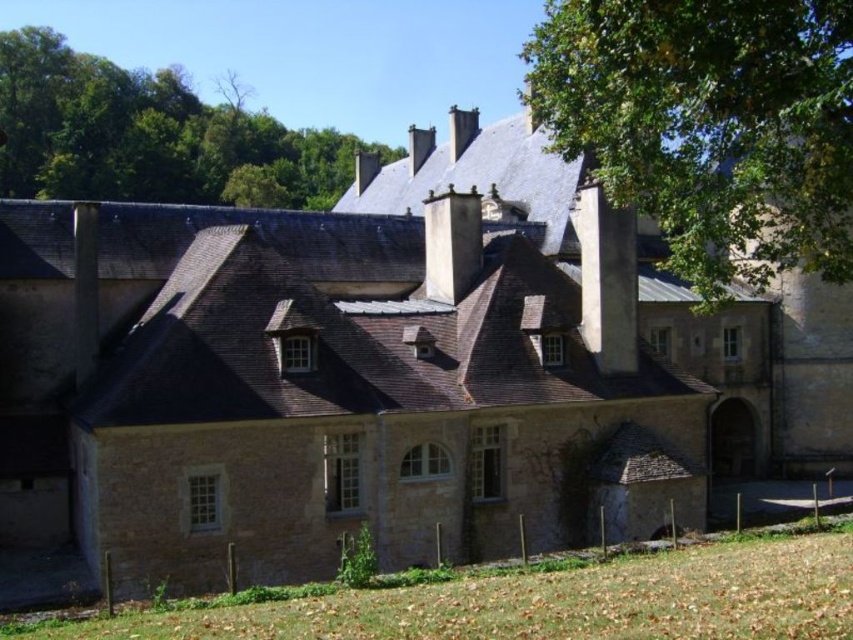
Question: Does green leafy tree at upper left appear over white stone chimney at center?

Choices:
 (A) no
 (B) yes

Answer: (B)

Question: Which point is closer to the camera?

Choices:
 (A) green leafy tree at upper right
 (B) white stone chimney at center
 (C) green leafy tree at upper left
 (D) white stone chimney at upper center

Answer: (A)

Question: Which object is positioned farthest from the green leafy tree at upper right?

Choices:
 (A) white stone chimney at upper center
 (B) green leafy tree at upper left

Answer: (B)

Question: Is white stone chimney at upper center positioned behind white stone chimney at center?

Choices:
 (A) no
 (B) yes

Answer: (A)

Question: Among these objects, which one is nearest to the camera?

Choices:
 (A) green leafy tree at upper right
 (B) white stone chimney at upper center
 (C) white stone chimney at center

Answer: (A)

Question: From the image, what is the correct spatial relationship of green leafy tree at upper left in relation to white stone chimney at upper center?

Choices:
 (A) left
 (B) right

Answer: (A)